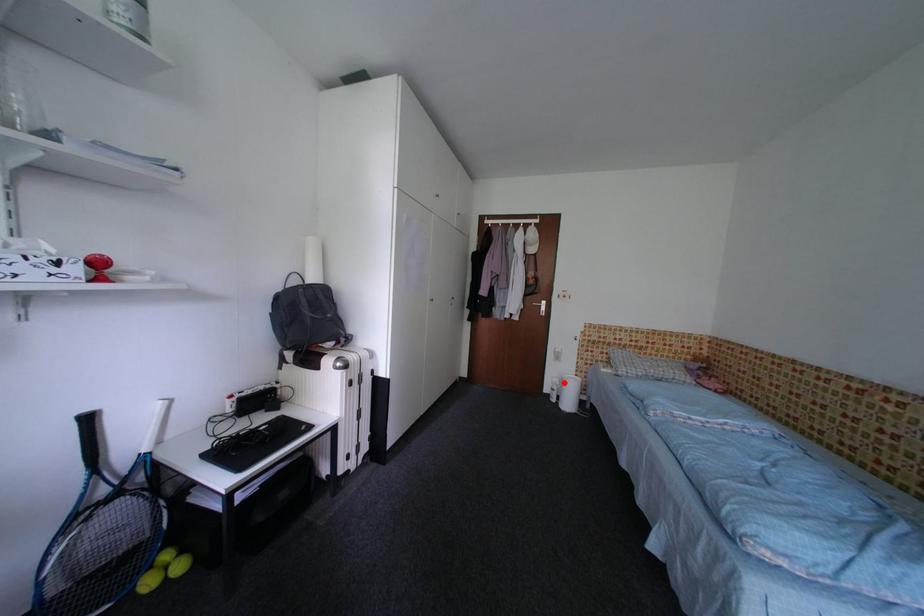
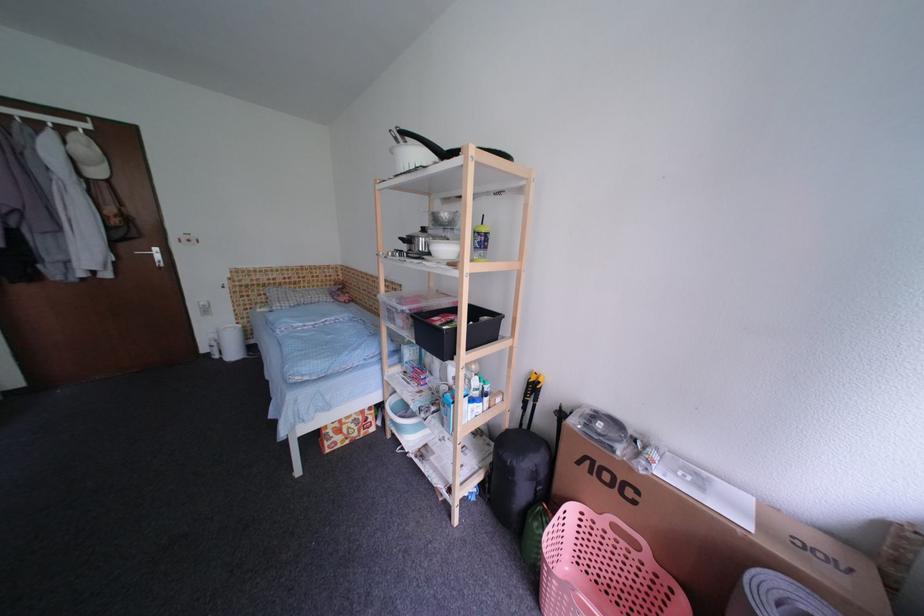
In the second image, find the point that corresponds to the highlighted location in the first image.

(222, 338)